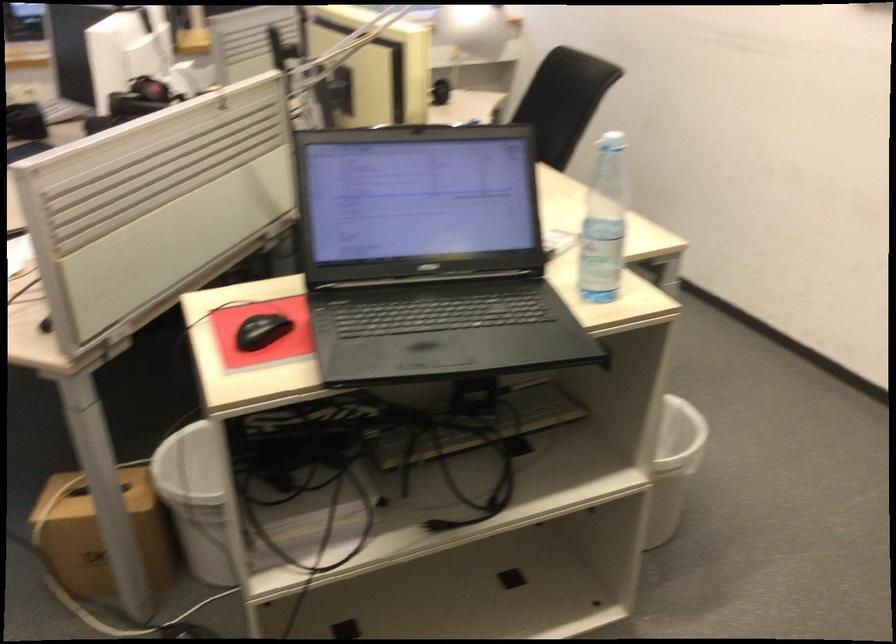
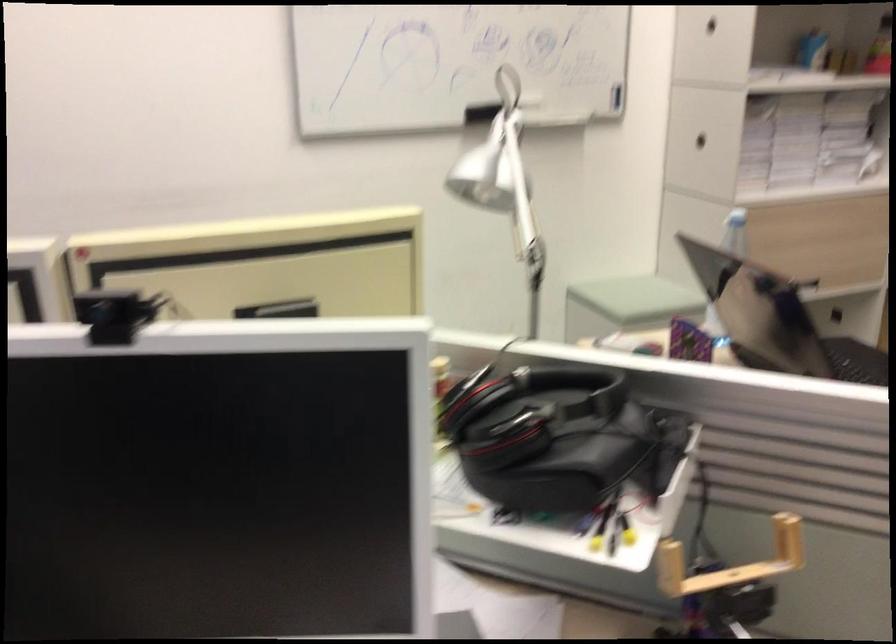
Question: I am providing you with two images of the same scene from different viewpoints. After the viewpoint changes to image2, which objects are now occluded?

Choices:
 (A) black webcam
 (B) black desk microphone
 (C) white bottle cap
 (D) wooden U-shaped handle

Answer: (C)